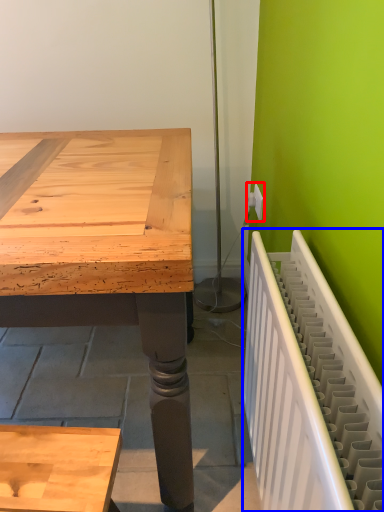
Question: Which object appears farthest to the camera in this image, electric outlet (highlighted by a red box) or radiator (highlighted by a blue box)?

Choices:
 (A) electric outlet
 (B) radiator

Answer: (A)